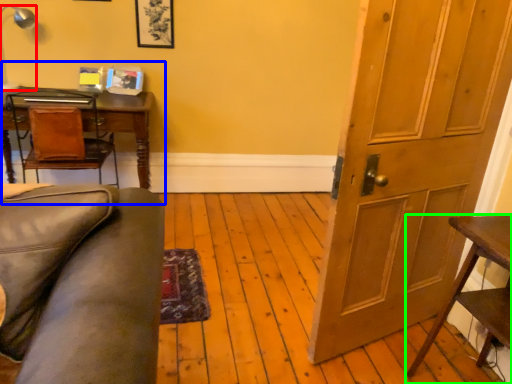
Question: Which is nearer to the lamp (highlighted by a red box)? computer desk (highlighted by a blue box) or table (highlighted by a green box).

Choices:
 (A) computer desk
 (B) table

Answer: (A)